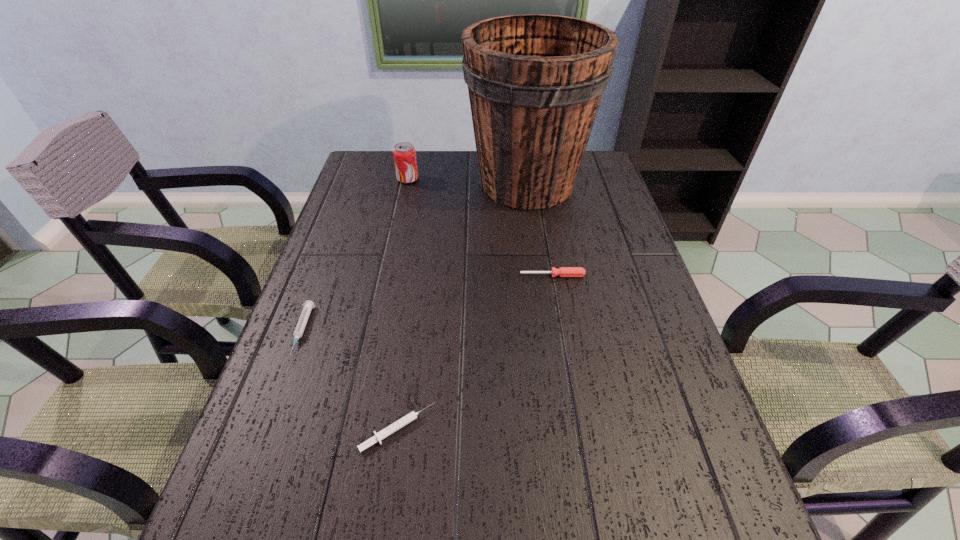
At what (x,y) coordinates should I click in order to perform the action: click on free space between the fourth shortest object and the bucket. Please return your answer as a coordinate pair (x, y). The width and height of the screenshot is (960, 540). Looking at the image, I should click on tap(468, 181).

This screenshot has height=540, width=960. Find the location of `unoccupied area between the bucket and the third nearest object`. unoccupied area between the bucket and the third nearest object is located at coordinates 540,230.

Locate an element on the screen. The width and height of the screenshot is (960, 540). free space between the tallest object and the second nearest object is located at coordinates click(x=415, y=258).

What are the coordinates of `vacant point located between the shortest object and the screwdriver` in the screenshot? It's located at (475, 352).

Locate an element on the screen. Image resolution: width=960 pixels, height=540 pixels. the fourth closest object to the nearest object is located at coordinates (404, 153).

Where is `object that stands as the second closest to the soda can`? This screenshot has height=540, width=960. object that stands as the second closest to the soda can is located at coordinates (562, 271).

Find the location of a particular element. free location that satisfies the following two spatial constraints: 1. on the front side of the third nearest object; 2. on the left side of the soda can is located at coordinates (387, 275).

Where is `free point that satisfies the following two spatial constraints: 1. on the front side of the right syringe; 2. on the left side of the second tallest object`? This screenshot has height=540, width=960. free point that satisfies the following two spatial constraints: 1. on the front side of the right syringe; 2. on the left side of the second tallest object is located at coordinates (352, 429).